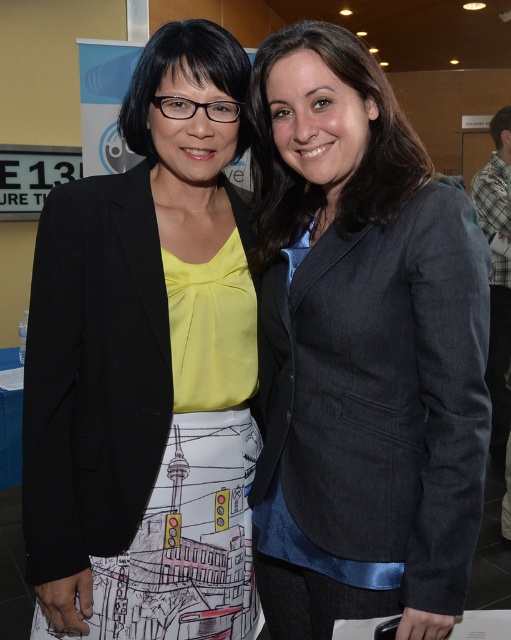
You are a fashion designer observing two blazers in the image. The dark gray textured blazer at center and the matte black blazer at center. Which blazer is bigger in size?

The dark gray textured blazer at center is larger in size than the matte black blazer at center.

You are at a networking event and need to approach the two women. The dark gray textured blazer at center is worn by the woman on the right, while the matte black blazer at center belongs to the woman on the left. Which blazer is closer to your right side as you face them?

The dark gray textured blazer at center is to the right of the matte black blazer at center, so if you face them, the dark gray textured blazer at center is closer to your right side.